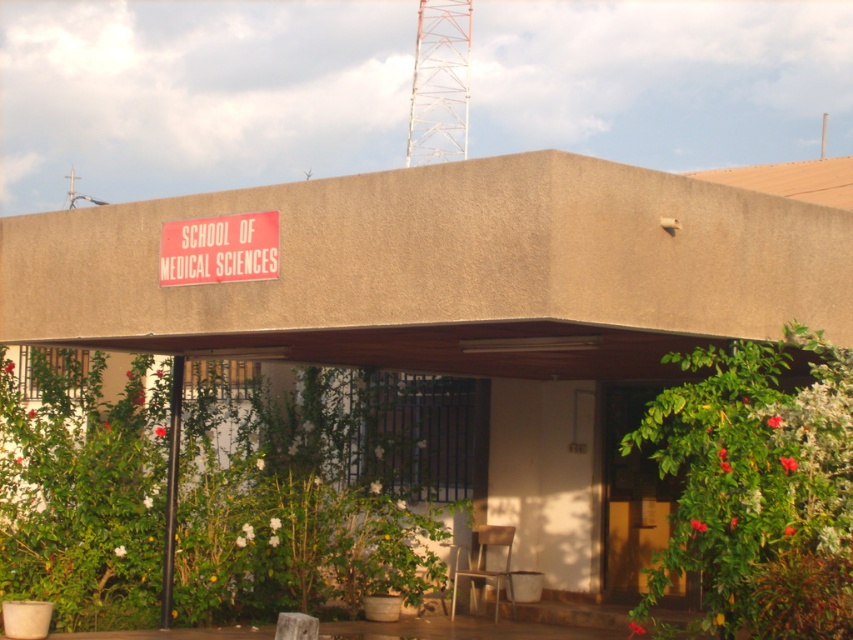
You are standing in front of the SCHOOL OF MEDICAL SCIENCES building. You need to locate the brown wooden door at center. Based on the coordinates provided, can you determine its exact location relative to the building?

The brown wooden door at center is located at coordinates point (631, 493) relative to the building.

You are standing at the entrance of the SCHOOL OF MEDICAL SCIENCES building. There is a point marked at coordinates (631,493). What does this point most likely represent?

The point at coordinates (631,493) most likely represents the brown wooden door at center, as indicated by the description.